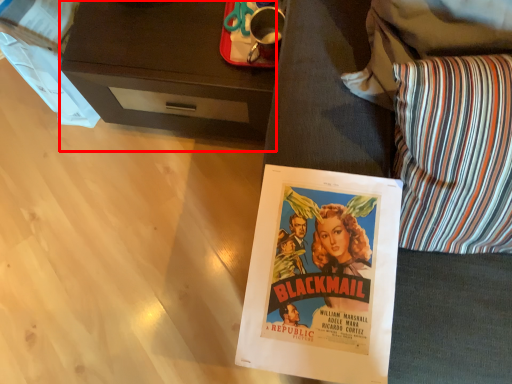
Question: From the image's perspective, where is desk (annotated by the red box) located relative to throw pillow?

Choices:
 (A) below
 (B) above

Answer: (B)